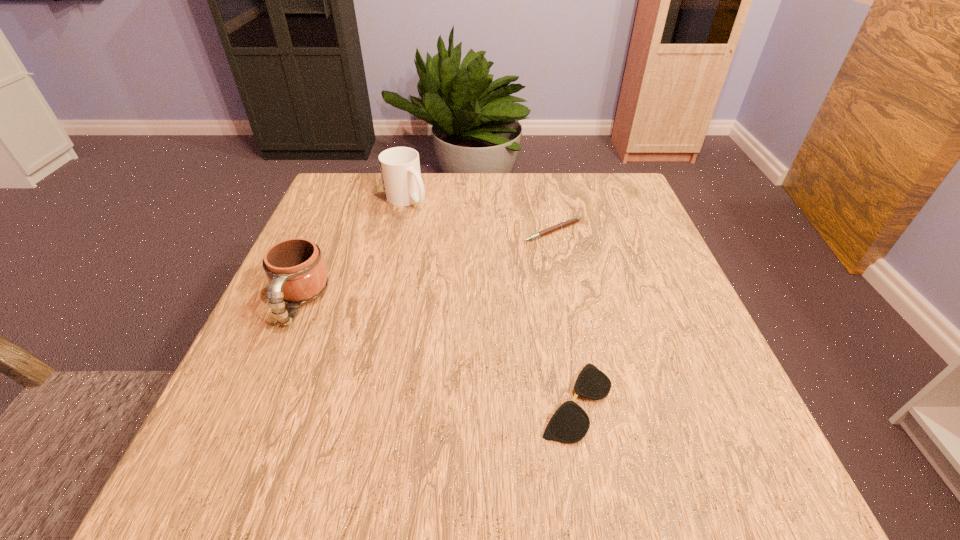
The image size is (960, 540). In the image, there is a desktop. Identify the location of vacant space at the far left corner. (338, 195).

Identify the location of vacant region at the near left corner of the desktop. (230, 489).

Locate an element on the screen. The image size is (960, 540). vacant space at the far right corner of the desktop is located at coordinates (602, 190).

Where is `free space that is in between the left mug and the second farthest object`? The width and height of the screenshot is (960, 540). free space that is in between the left mug and the second farthest object is located at coordinates (426, 266).

You are a GUI agent. You are given a task and a screenshot of the screen. Output one action in this format:
    pyautogui.click(x=<x>, y=<y>)
    Task: Click on the vacant area that lies between the second nearest object and the farthest object
    
    Given the screenshot: What is the action you would take?
    pyautogui.click(x=353, y=251)

You are a GUI agent. You are given a task and a screenshot of the screen. Output one action in this format:
    pyautogui.click(x=<x>, y=<y>)
    Task: Click on the free area in between the second shortest object and the spectacles
    This screenshot has height=540, width=960.
    Given the screenshot: What is the action you would take?
    pyautogui.click(x=564, y=316)

Identify the location of vacant area between the second nearest object and the nearest object. This screenshot has height=540, width=960. (438, 352).

This screenshot has width=960, height=540. Identify the location of free point between the shortest object and the pen. (564, 316).

This screenshot has height=540, width=960. What are the coordinates of `free space between the spectacles and the farthest object` in the screenshot? It's located at (492, 300).

The height and width of the screenshot is (540, 960). What are the coordinates of `free space between the nearer mug and the farthest object` in the screenshot? It's located at (353, 251).